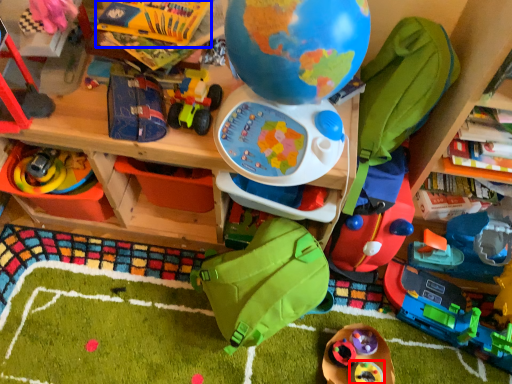
Question: Which object appears farthest to the camera in this image, toy (highlighted by a red box) or toy (highlighted by a blue box)?

Choices:
 (A) toy
 (B) toy

Answer: (A)